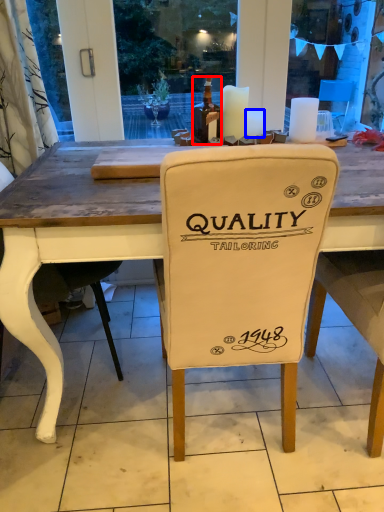
Question: Which of the following is the closest to the observer, bottle (highlighted by a red box) or candle (highlighted by a blue box)?

Choices:
 (A) bottle
 (B) candle

Answer: (A)